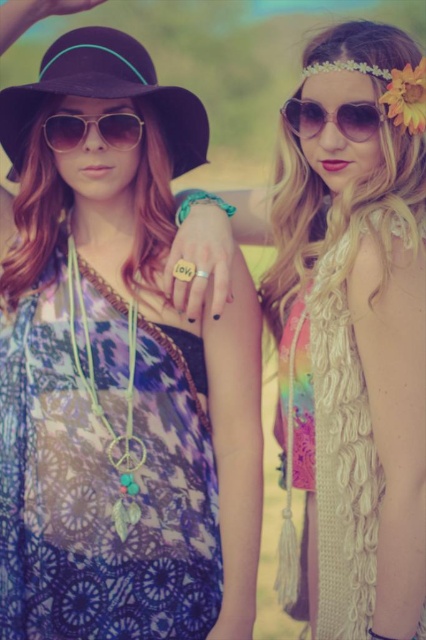
Does crochet lace dress at center have a larger size compared to sunglasses at upper right?

Correct, crochet lace dress at center is larger in size than sunglasses at upper right.

Between crochet lace dress at center and sunglasses at upper right, which one is positioned lower?

crochet lace dress at center

Between point (112, 637) and point (345, 104), which one is positioned behind?

Positioned behind is point (112, 637).

Image resolution: width=426 pixels, height=640 pixels. Find the location of `crochet lace dress at center`. crochet lace dress at center is located at coordinates (100, 488).

Is white knitted vest at right smaller than black felt hat at upper left?

No, white knitted vest at right is not smaller than black felt hat at upper left.

Between point (337, 513) and point (3, 120), which one is positioned behind?

Positioned behind is point (3, 120).

Where is `white knitted vest at right`? This screenshot has height=640, width=426. white knitted vest at right is located at coordinates (336, 433).

Can you confirm if white knitted scarf at upper right is positioned to the left of sunglasses at upper right?

No, white knitted scarf at upper right is not to the left of sunglasses at upper right.

Between white knitted scarf at upper right and sunglasses at upper right, which one is positioned higher?

sunglasses at upper right is higher up.

Does point (311, 560) come farther from viewer compared to point (342, 124)?

Yes.

Image resolution: width=426 pixels, height=640 pixels. What are the coordinates of `white knitted scarf at upper right` in the screenshot? It's located at (354, 340).